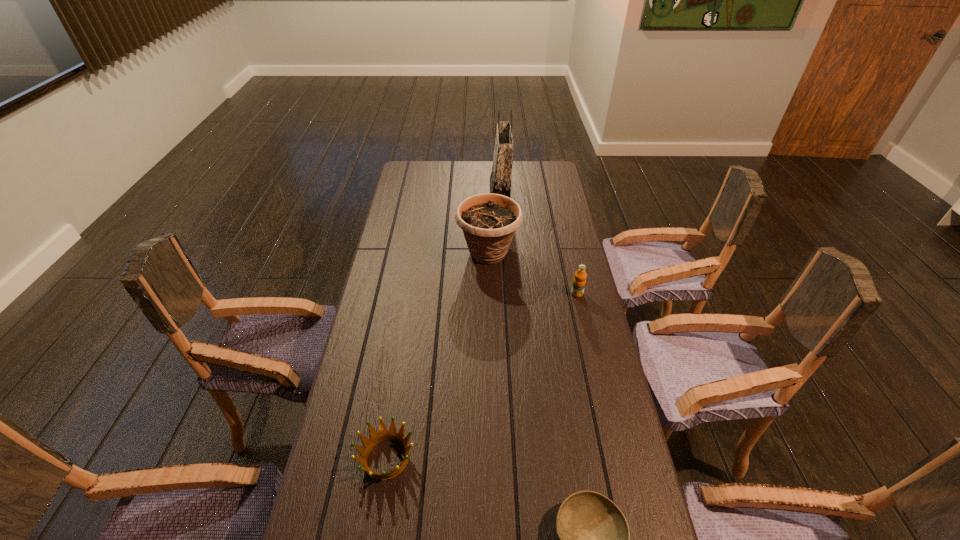
You are a GUI agent. You are given a task and a screenshot of the screen. Output one action in this format:
    pyautogui.click(x=<x>, y=<y>)
    Task: Click on the tallest object
    This screenshot has height=540, width=960.
    Given the screenshot: What is the action you would take?
    pyautogui.click(x=500, y=179)

Image resolution: width=960 pixels, height=540 pixels. In order to click on the farthest object in this screenshot , I will do `click(500, 179)`.

Image resolution: width=960 pixels, height=540 pixels. What are the coordinates of `the fourth nearest object` in the screenshot? It's located at [488, 221].

Locate an element on the screen. The image size is (960, 540). flowerpot is located at coordinates (488, 221).

I want to click on the third shortest object, so click(579, 281).

Image resolution: width=960 pixels, height=540 pixels. What are the coordinates of `the third nearest object` in the screenshot? It's located at (579, 281).

Locate an element on the screen. The height and width of the screenshot is (540, 960). the fourth tallest object is located at coordinates (375, 438).

Identify the location of the leftmost object. Image resolution: width=960 pixels, height=540 pixels. (375, 438).

Where is `blank space located 0.310m on the front of the shopping bag with the design`? The width and height of the screenshot is (960, 540). blank space located 0.310m on the front of the shopping bag with the design is located at coordinates (422, 192).

Locate an element on the screen. The width and height of the screenshot is (960, 540). vacant space located on the front of the shopping bag with the design is located at coordinates pos(477,192).